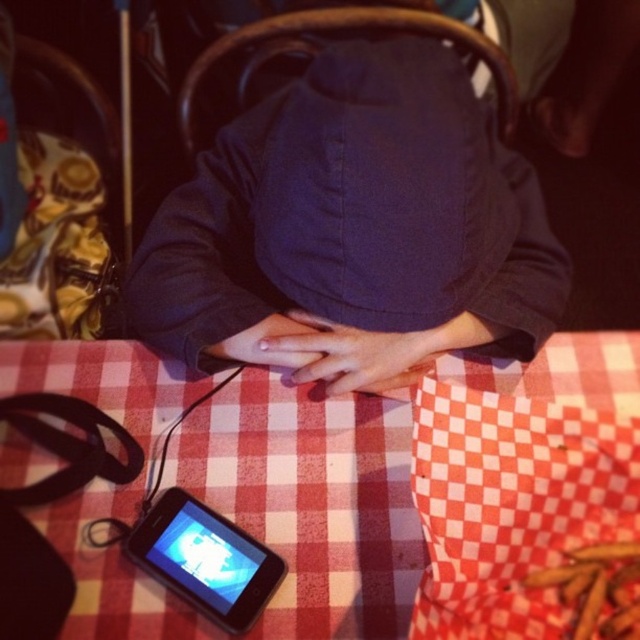
Question: Can you confirm if dark blue fabric at center is wider than black glossy ipod at lower left?

Choices:
 (A) yes
 (B) no

Answer: (A)

Question: Which of the following is the farthest from the observer?

Choices:
 (A) (413, 168)
 (B) (232, 572)

Answer: (B)

Question: Among these points, which one is nearest to the camera?

Choices:
 (A) (x=253, y=538)
 (B) (x=358, y=76)

Answer: (B)

Question: Is dark blue fabric at center to the left of black glossy ipod at lower left from the viewer's perspective?

Choices:
 (A) yes
 (B) no

Answer: (B)

Question: Where is dark blue fabric at center located in relation to black glossy ipod at lower left in the image?

Choices:
 (A) above
 (B) below

Answer: (A)